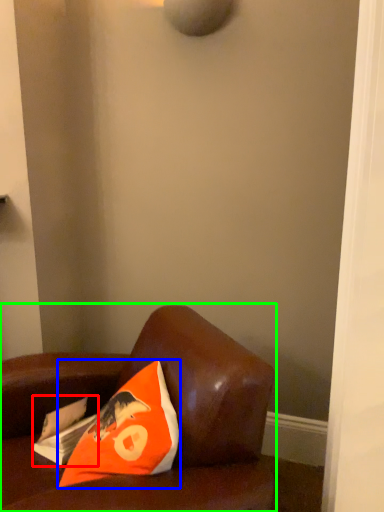
Question: Estimate the real-world distances between objects in this image. Which object is closer to magazine (highlighted by a red box), pillow (highlighted by a blue box) or furniture (highlighted by a green box)?

Choices:
 (A) pillow
 (B) furniture

Answer: (A)